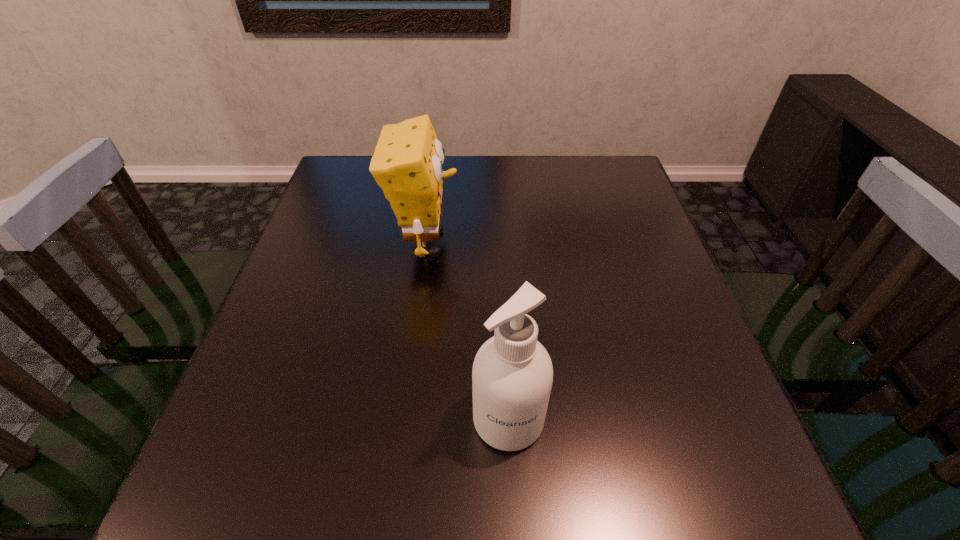
Where is `the nearer object`? the nearer object is located at coordinates (512, 375).

Image resolution: width=960 pixels, height=540 pixels. Identify the location of the right object. (512, 375).

The width and height of the screenshot is (960, 540). I want to click on the farther object, so click(x=407, y=164).

I want to click on the left object, so click(x=407, y=164).

The width and height of the screenshot is (960, 540). Find the location of `free location located on the front label of the cleansing agent`. free location located on the front label of the cleansing agent is located at coordinates (513, 515).

Where is `free space located on the face of the left object`? The height and width of the screenshot is (540, 960). free space located on the face of the left object is located at coordinates (611, 242).

What are the coordinates of `free space at the far edge` in the screenshot? It's located at (528, 179).

Locate an element on the screen. The height and width of the screenshot is (540, 960). vacant space at the near edge is located at coordinates click(x=478, y=522).

I want to click on vacant point at the left edge, so click(x=328, y=250).

You are a GUI agent. You are given a task and a screenshot of the screen. Output one action in this format:
    pyautogui.click(x=<x>, y=<y>)
    Task: Click on the vacant position at the right edge of the desktop
    
    Given the screenshot: What is the action you would take?
    pyautogui.click(x=638, y=281)